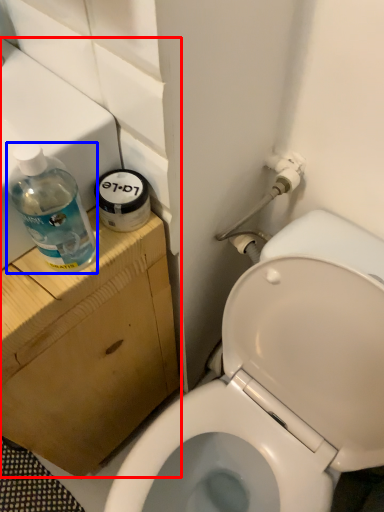
Question: Which point is closer to the camera, sink (highlighted by a red box) or bottle (highlighted by a blue box)?

Choices:
 (A) sink
 (B) bottle

Answer: (B)